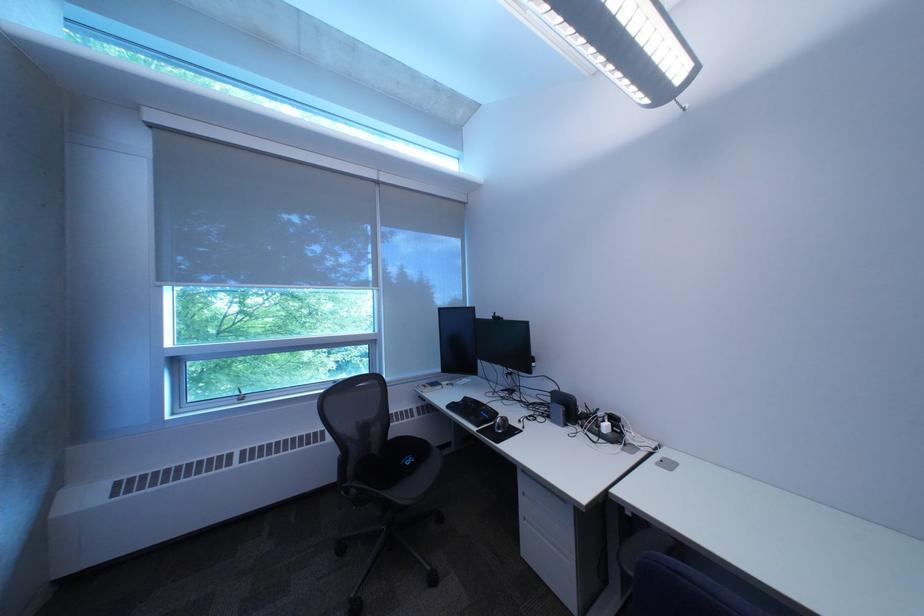
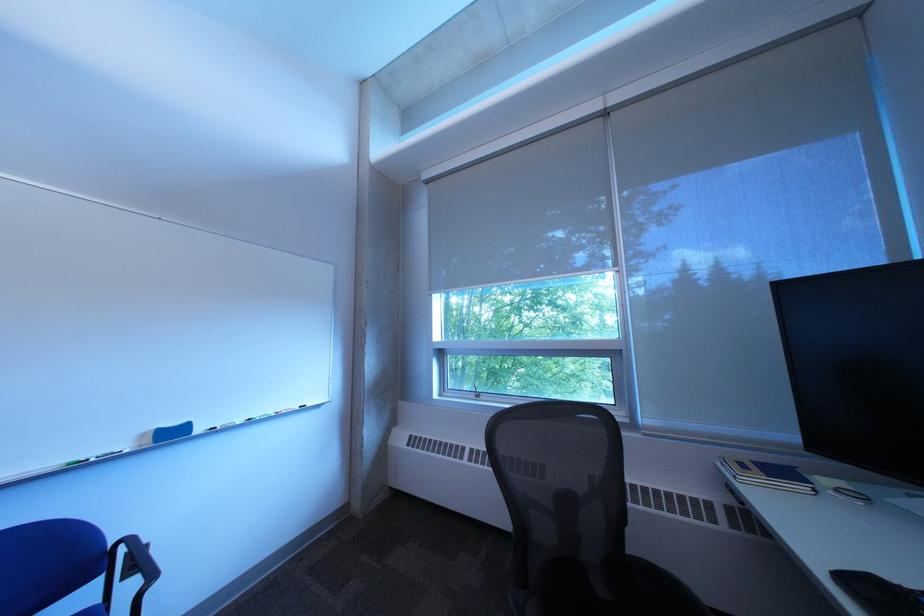
Where in the second image is the point corresponding to point (464, 408) from the first image?

(860, 582)